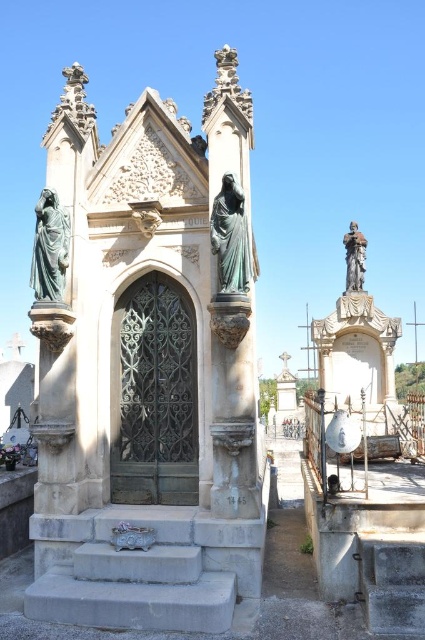
Question: Which of the following is the closest to the observer?

Choices:
 (A) (44, 232)
 (B) (396, 557)
 (C) (235, 317)

Answer: (B)

Question: Estimate the real-world distances between objects in this image. Which object is farther from the green patina stone statue at center?

Choices:
 (A) bronze statue at upper right
 (B) green marble statue at left

Answer: (A)

Question: Is green patina stone statue at center further to the viewer compared to green marble statue at left?

Choices:
 (A) yes
 (B) no

Answer: (B)

Question: Which object appears farthest from the camera in this image?

Choices:
 (A) green patina statue at center
 (B) gray concrete stair at lower right

Answer: (A)

Question: Can you confirm if gray concrete stair at lower right is wider than green patina statue at center?

Choices:
 (A) no
 (B) yes

Answer: (B)

Question: Does gray concrete stair at lower right have a larger size compared to green patina statue at center?

Choices:
 (A) yes
 (B) no

Answer: (A)